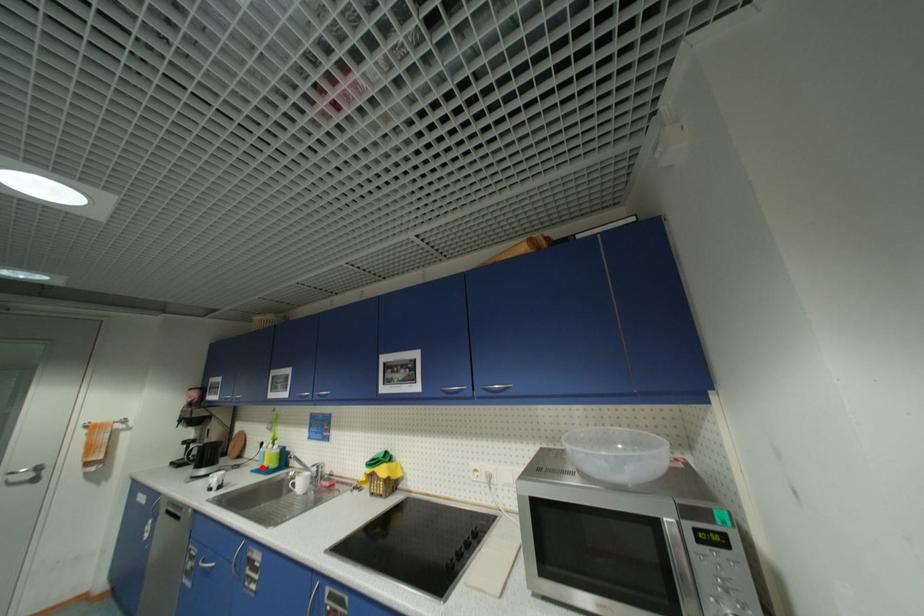
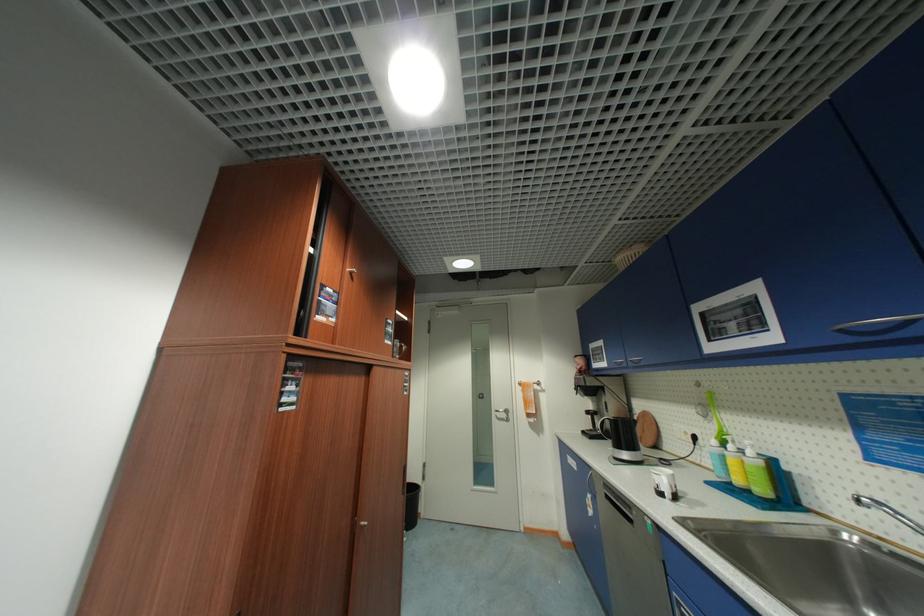
In the second image, find the point that corresponds to the highlighted location in the first image.

(719, 479)